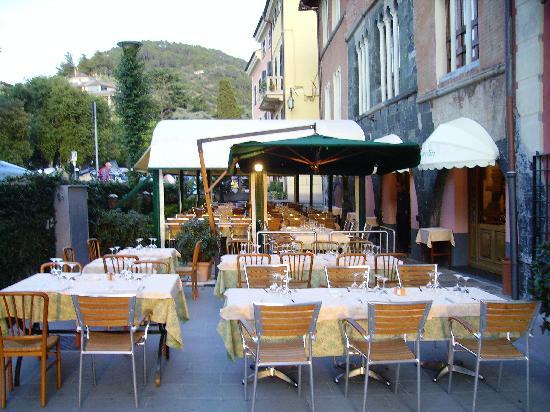
At what (x,y) coordinates should I click in order to perform the action: click on tablecloths. Please return your answer as a coordinate pair (x, y). Looking at the image, I should click on (160, 321), (169, 266), (308, 234), (324, 274), (330, 344).